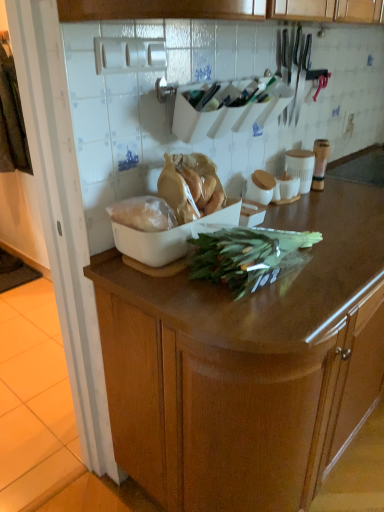
Question: Does white plastic bag at center, which is the 2th food in right-to-left order, turn towards wooden cabinet at center?

Choices:
 (A) yes
 (B) no

Answer: (B)

Question: Is the position of white plastic bag at center, which ranks as the 1th food in left-to-right order, more distant than that of wooden cabinet at center?

Choices:
 (A) no
 (B) yes

Answer: (B)

Question: Can we say white plastic bag at center, which is the 2th food in right-to-left order, lies outside wooden cabinet at center?

Choices:
 (A) no
 (B) yes

Answer: (B)

Question: Is white plastic bag at center, which is the 2th food in right-to-left order, shorter than wooden cabinet at center?

Choices:
 (A) no
 (B) yes

Answer: (B)

Question: Is white plastic bag at center, which ranks as the 1th food in left-to-right order, bigger than wooden cabinet at center?

Choices:
 (A) yes
 (B) no

Answer: (B)

Question: Considering their positions, is green leafy at center located in front of or behind wooden cabinet at center?

Choices:
 (A) front
 (B) behind

Answer: (B)

Question: From a real-world perspective, is green leafy at center above or below wooden cabinet at center?

Choices:
 (A) below
 (B) above

Answer: (B)

Question: Is green leafy at center inside the boundaries of wooden cabinet at center, or outside?

Choices:
 (A) outside
 (B) inside

Answer: (A)

Question: In terms of width, does green leafy at center look wider or thinner when compared to wooden cabinet at center?

Choices:
 (A) wide
 (B) thin

Answer: (B)

Question: Is wooden cabinet at center inside or outside of green leafy at center?

Choices:
 (A) inside
 (B) outside

Answer: (B)

Question: In terms of size, does wooden cabinet at center appear bigger or smaller than green leafy at center?

Choices:
 (A) big
 (B) small

Answer: (A)

Question: Is point (244, 306) closer or farther from the camera than point (296, 244)?

Choices:
 (A) closer
 (B) farther

Answer: (A)

Question: In terms of width, does wooden cabinet at center look wider or thinner when compared to green leafy at center?

Choices:
 (A) thin
 (B) wide

Answer: (B)

Question: In terms of size, does white plastic bag at center, which ranks as the 1th food in left-to-right order, appear bigger or smaller than translucent plastic bag at center, the first food when ordered from right to left?

Choices:
 (A) big
 (B) small

Answer: (B)

Question: From the image's perspective, is white plastic bag at center, which ranks as the 1th food in left-to-right order, above or below translucent plastic bag at center, placed as the 2th food when sorted from left to right?

Choices:
 (A) above
 (B) below

Answer: (B)